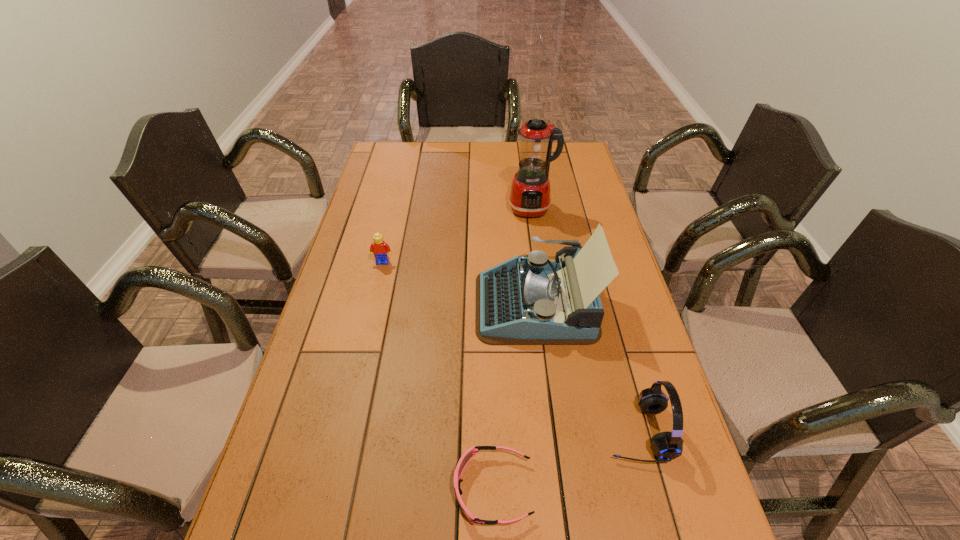
You are a GUI agent. You are given a task and a screenshot of the screen. Output one action in this format:
    pyautogui.click(x=<x>, y=<y>)
    Task: Click on the tallest object
    
    Given the screenshot: What is the action you would take?
    pyautogui.click(x=529, y=196)

You are a GUI agent. You are given a task and a screenshot of the screen. Output one action in this format:
    pyautogui.click(x=<x>, y=<y>)
    Task: Click on the food processor
    Image resolution: width=960 pixels, height=540 pixels.
    Given the screenshot: What is the action you would take?
    pyautogui.click(x=529, y=196)

Identify the location of the third farthest object. Image resolution: width=960 pixels, height=540 pixels. (527, 300).

Find the location of a particular element. typewriter is located at coordinates (527, 300).

I want to click on the third shortest object, so click(x=667, y=446).

Where is `the second farthest object`? the second farthest object is located at coordinates (380, 249).

Locate an element on the screen. The image size is (960, 540). the second shortest object is located at coordinates point(380,249).

Where is `the shortest object`? The image size is (960, 540). the shortest object is located at coordinates (470, 453).

I want to click on free region located on the controls of the tallest object, so click(x=543, y=295).

Where is `free space located on the typing side of the typewriter`? This screenshot has width=960, height=540. free space located on the typing side of the typewriter is located at coordinates (458, 304).